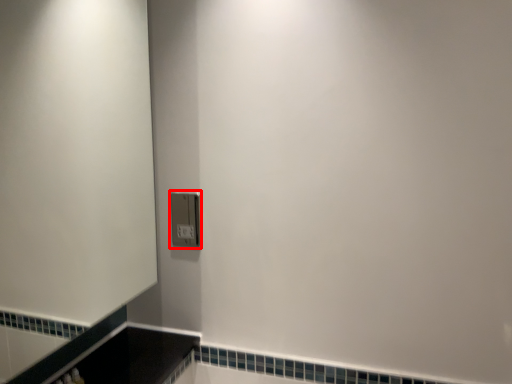
Question: From the image, what is the correct spatial relationship of light switch (annotated by the red box) in relation to screen door?

Choices:
 (A) right
 (B) left

Answer: (A)